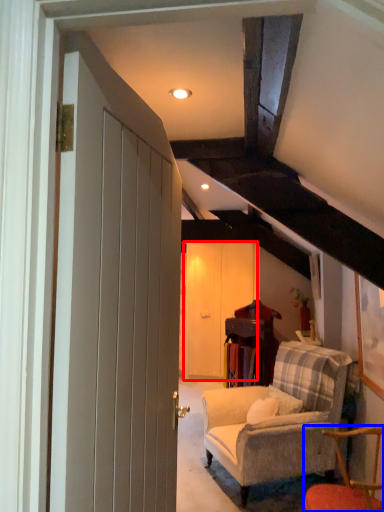
Question: Which of the following is the farthest to the observer, barn door (highlighted by a red box) or chair (highlighted by a blue box)?

Choices:
 (A) barn door
 (B) chair

Answer: (A)